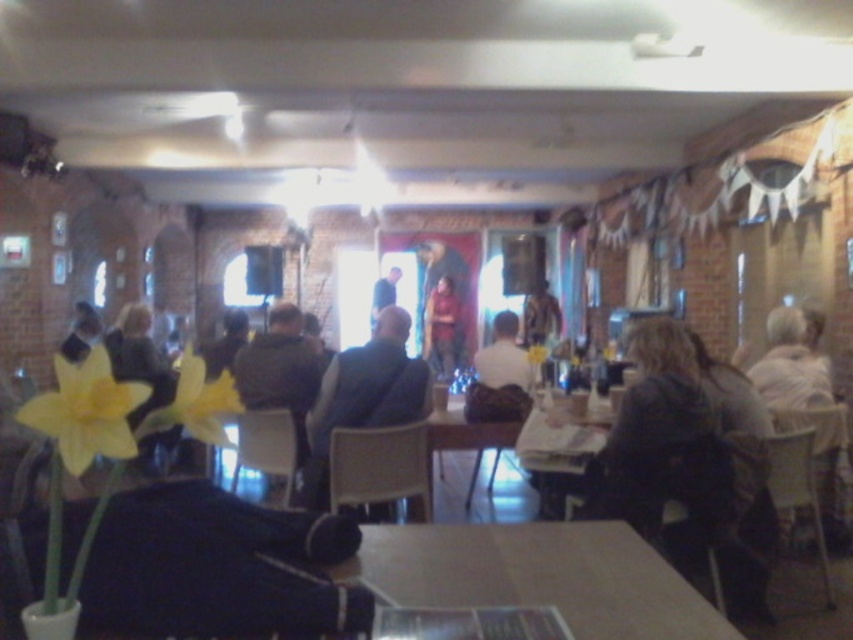
Question: Is wooden table at center behind dark brown leather jacket at center?

Choices:
 (A) no
 (B) yes

Answer: (A)

Question: Among these points, which one is farthest from the camera?

Choices:
 (A) (91, 339)
 (B) (508, 369)
 (C) (560, 572)

Answer: (A)

Question: Which object is closer to the camera taking this photo?

Choices:
 (A) dark blue vest at center
 (B) wooden table at center

Answer: (B)

Question: Is dark blue vest at center smaller than matte black jacket at left?

Choices:
 (A) yes
 (B) no

Answer: (B)

Question: Can you confirm if yellow matte flower at center is bigger than matte red shirt at center?

Choices:
 (A) yes
 (B) no

Answer: (B)

Question: Estimate the real-world distances between objects in this image. Which object is farther from the white shirt at center?

Choices:
 (A) wooden table at center
 (B) dark brown leather jacket at center

Answer: (A)